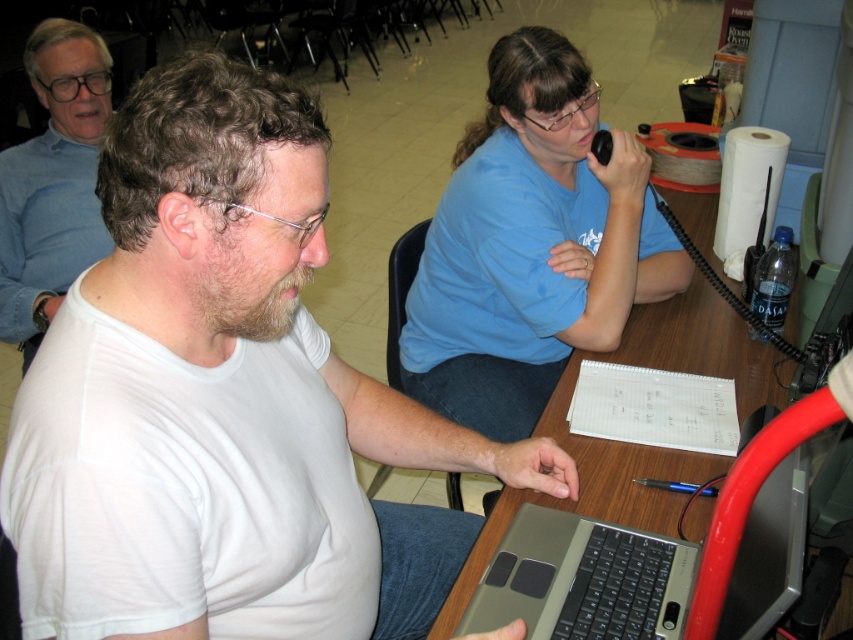
Question: Is silver/black laptop at lower center smaller than wooden table at center?

Choices:
 (A) yes
 (B) no

Answer: (A)

Question: Which point is farther from the camera taking this photo?

Choices:
 (A) (631, 145)
 (B) (751, 529)
 (C) (49, 432)

Answer: (A)

Question: Can you confirm if silver/black laptop at lower center is smaller than wooden table at center?

Choices:
 (A) yes
 (B) no

Answer: (A)

Question: Can you confirm if blue cotton shirt at upper center is wider than silver/black laptop at lower center?

Choices:
 (A) no
 (B) yes

Answer: (B)

Question: Which point appears closest to the camera in this image?

Choices:
 (A) (671, 573)
 (B) (97, 371)
 (C) (547, 177)

Answer: (B)

Question: Which is nearer to the blue cotton shirt at upper center?

Choices:
 (A) white matte t-shirt at upper left
 (B) white matte shirt at center

Answer: (B)